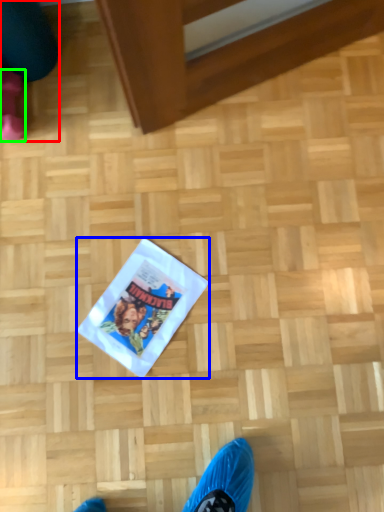
Question: Which object is positioned farthest from leg (highlighted by a red box)? Select from flyer (highlighted by a blue box) and footwear (highlighted by a green box).

Choices:
 (A) flyer
 (B) footwear

Answer: (A)